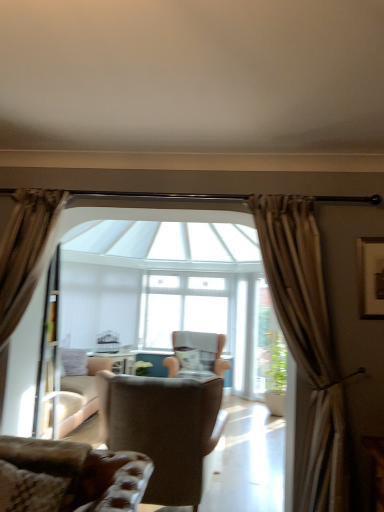
This screenshot has height=512, width=384. Describe the element at coordinates (220, 357) in the screenshot. I see `velvet brown armchair at center, acting as the first chair starting from the back` at that location.

Where is `velvet brown armchair at center, acting as the first chair starting from the back`? velvet brown armchair at center, acting as the first chair starting from the back is located at coordinates (220, 357).

What is the approximate width of velvet gray pillow at center?

It is 11.77 inches.

Where is `velvet brown armchair at center, acting as the first chair starting from the back`? This screenshot has height=512, width=384. velvet brown armchair at center, acting as the first chair starting from the back is located at coordinates (220, 357).

Is brown leather armchair at center, marked as the second chair in a front-to-back arrangement, facing away from wooden framed artwork at upper right?

brown leather armchair at center, marked as the second chair in a front-to-back arrangement, is not turned away from wooden framed artwork at upper right.

From a real-world perspective, which is physically below, brown leather armchair at center, marked as the second chair in a front-to-back arrangement, or wooden framed artwork at upper right?

brown leather armchair at center, marked as the second chair in a front-to-back arrangement, is physically lower.

Could you measure the distance between brown leather armchair at center, which ranks as the second chair in back-to-front order, and wooden framed artwork at upper right?

The distance of brown leather armchair at center, which ranks as the second chair in back-to-front order, from wooden framed artwork at upper right is 4.47 feet.

Between brown leather armchair at center, marked as the second chair in a front-to-back arrangement, and wooden framed artwork at upper right, which one is positioned behind?

brown leather armchair at center, marked as the second chair in a front-to-back arrangement, is more distant.

Considering the positions of point (170, 416) and point (5, 500), is point (170, 416) closer or farther from the camera than point (5, 500)?

Point (170, 416) is positioned farther from the camera compared to point (5, 500).

Is brown leather armchair at center, marked as the second chair in a front-to-back arrangement, surrounding leather at lower left, which ranks as the 3th chair in back-to-front order?

No, leather at lower left, which ranks as the 3th chair in back-to-front order, is not inside brown leather armchair at center, marked as the second chair in a front-to-back arrangement.

Where is `chair that is on the left side of brown leather armchair at center, which ranks as the second chair in back-to-front order`? chair that is on the left side of brown leather armchair at center, which ranks as the second chair in back-to-front order is located at coordinates (69, 477).

From a real-world perspective, which object stands above the other?

leather at lower left, which ranks as the 3th chair in back-to-front order, from a real-world perspective.

The image size is (384, 512). Find the location of `the 2nd chair behind when counting from the leather at lower left, which appears as the 1th chair when viewed from the front`. the 2nd chair behind when counting from the leather at lower left, which appears as the 1th chair when viewed from the front is located at coordinates (220, 357).

Considering the positions of objects leather at lower left, which ranks as the 3th chair in back-to-front order, and velvet brown armchair at center, acting as the first chair starting from the back, in the image provided, who is behind, leather at lower left, which ranks as the 3th chair in back-to-front order, or velvet brown armchair at center, acting as the first chair starting from the back,?

velvet brown armchair at center, acting as the first chair starting from the back, is behind.

Which is more to the left, leather at lower left, which appears as the 1th chair when viewed from the front, or velvet brown armchair at center, acting as the third chair starting from the front?

leather at lower left, which appears as the 1th chair when viewed from the front.

From a real-world perspective, is brown leather armchair at center, which ranks as the second chair in back-to-front order, positioned above or below velvet brown armchair at center, acting as the first chair starting from the back?

From a real-world perspective, brown leather armchair at center, which ranks as the second chair in back-to-front order, is physically below velvet brown armchair at center, acting as the first chair starting from the back.

Could you tell me if brown leather armchair at center, which ranks as the second chair in back-to-front order, is facing velvet brown armchair at center, acting as the first chair starting from the back?

Yes, brown leather armchair at center, which ranks as the second chair in back-to-front order, is aimed at velvet brown armchair at center, acting as the first chair starting from the back.

From the image's perspective, between brown leather armchair at center, marked as the second chair in a front-to-back arrangement, and velvet brown armchair at center, acting as the first chair starting from the back, who is located below?

velvet brown armchair at center, acting as the first chair starting from the back, from the image's perspective.

Is the depth of velvet brown armchair at center, acting as the third chair starting from the front, greater than that of brown leather armchair at center, which ranks as the second chair in back-to-front order?

Yes.

In terms of size, does velvet brown armchair at center, acting as the first chair starting from the back, appear bigger or smaller than brown leather armchair at center, which ranks as the second chair in back-to-front order?

velvet brown armchair at center, acting as the first chair starting from the back, is bigger than brown leather armchair at center, which ranks as the second chair in back-to-front order.

From a real-world perspective, which is physically above, velvet brown armchair at center, acting as the third chair starting from the front, or brown leather armchair at center, marked as the second chair in a front-to-back arrangement?

From a 3D spatial view, velvet brown armchair at center, acting as the third chair starting from the front, is above.

Would you say velvet brown armchair at center, acting as the third chair starting from the front, contains brown leather armchair at center, which ranks as the second chair in back-to-front order?

No, brown leather armchair at center, which ranks as the second chair in back-to-front order, is not inside velvet brown armchair at center, acting as the third chair starting from the front.

Is leather at lower left, which appears as the 1th chair when viewed from the front, at the back of velvet gray pillow at center?

No, velvet gray pillow at center is not facing the opposite direction of leather at lower left, which appears as the 1th chair when viewed from the front.

Are velvet gray pillow at center and leather at lower left, which ranks as the 3th chair in back-to-front order, located far from each other?

Yes, velvet gray pillow at center and leather at lower left, which ranks as the 3th chair in back-to-front order, are quite far apart.

Between velvet gray pillow at center and leather at lower left, which appears as the 1th chair when viewed from the front, which one appears on the right side from the viewer's perspective?

From the viewer's perspective, velvet gray pillow at center appears more on the right side.

Is velvet gray pillow at center taller than leather at lower left, which appears as the 1th chair when viewed from the front?

Correct, velvet gray pillow at center is much taller as leather at lower left, which appears as the 1th chair when viewed from the front.

Consider the image. Is velvet gray pillow at center closer to the viewer compared to clear glass window at center?

→ Yes, velvet gray pillow at center is closer to the viewer.

Is velvet gray pillow at center completely or partially outside of clear glass window at center?

Yes, velvet gray pillow at center is outside of clear glass window at center.

Can you see velvet gray pillow at center touching clear glass window at center?

No, velvet gray pillow at center is not in contact with clear glass window at center.

The image size is (384, 512). Find the location of `the 2nd chair below the wooden framed artwork at upper right (from the image's perspective)`. the 2nd chair below the wooden framed artwork at upper right (from the image's perspective) is located at coordinates (164, 429).

At what (x,y) coordinates should I click in order to perform the action: click on chair above the brown leather armchair at center, marked as the second chair in a front-to-back arrangement (from the image's perspective). Please return your answer as a coordinate pair (x, y). This screenshot has width=384, height=512. Looking at the image, I should click on (69, 477).

Based on their spatial positions, is wooden framed artwork at upper right or clear glass window at center further from brown leather armchair at center, marked as the second chair in a front-to-back arrangement?

The object further to brown leather armchair at center, marked as the second chair in a front-to-back arrangement, is clear glass window at center.

Estimate the real-world distances between objects in this image. Which object is further from clear glass window at center, leather at lower left, which appears as the 1th chair when viewed from the front, or velvet gray pillow at center?

leather at lower left, which appears as the 1th chair when viewed from the front, is positioned further to the anchor clear glass window at center.

Estimate the real-world distances between objects in this image. Which object is further from velvet brown armchair at center, acting as the first chair starting from the back, wooden framed artwork at upper right or leather at lower left, which appears as the 1th chair when viewed from the front?

leather at lower left, which appears as the 1th chair when viewed from the front, is further to velvet brown armchair at center, acting as the first chair starting from the back.

Looking at the image, which one is located closer to brown leather armchair at center, which ranks as the second chair in back-to-front order, clear glass window at center or velvet brown armchair at center, acting as the first chair starting from the back?

velvet brown armchair at center, acting as the first chair starting from the back, is positioned closer to the anchor brown leather armchair at center, which ranks as the second chair in back-to-front order.

Which object lies nearer to the anchor point velvet brown armchair at center, acting as the third chair starting from the front, clear glass window at center or brown leather armchair at center, marked as the second chair in a front-to-back arrangement?

Among the two, clear glass window at center is located nearer to velvet brown armchair at center, acting as the third chair starting from the front.

Which object lies further to the anchor point clear glass window at center, wooden framed artwork at upper right or leather at lower left, which ranks as the 3th chair in back-to-front order?

leather at lower left, which ranks as the 3th chair in back-to-front order, lies further to clear glass window at center than the other object.

When comparing their distances from clear glass window at center, does leather at lower left, which appears as the 1th chair when viewed from the front, or velvet brown armchair at center, acting as the third chair starting from the front, seem further?

leather at lower left, which appears as the 1th chair when viewed from the front, is further to clear glass window at center.

Estimate the real-world distances between objects in this image. Which object is further from wooden framed artwork at upper right, clear glass window at center or leather at lower left, which ranks as the 3th chair in back-to-front order?

clear glass window at center.

Locate an element on the screen. pillow between wooden framed artwork at upper right and clear glass window at center from front to back is located at coordinates click(x=189, y=358).

Find the location of a particular element. picture frame between leather at lower left, which ranks as the 3th chair in back-to-front order, and velvet gray pillow at center from front to back is located at coordinates (370, 277).

At what (x,y) coordinates should I click in order to perform the action: click on chair between brown leather armchair at center, marked as the second chair in a front-to-back arrangement, and velvet gray pillow at center in the front-back direction. Please return your answer as a coordinate pair (x, y). The image size is (384, 512). Looking at the image, I should click on (220, 357).

At what (x,y) coordinates should I click in order to perform the action: click on pillow positioned between brown leather armchair at center, marked as the second chair in a front-to-back arrangement, and clear glass window at center from near to far. Please return your answer as a coordinate pair (x, y). The height and width of the screenshot is (512, 384). Looking at the image, I should click on (189, 358).